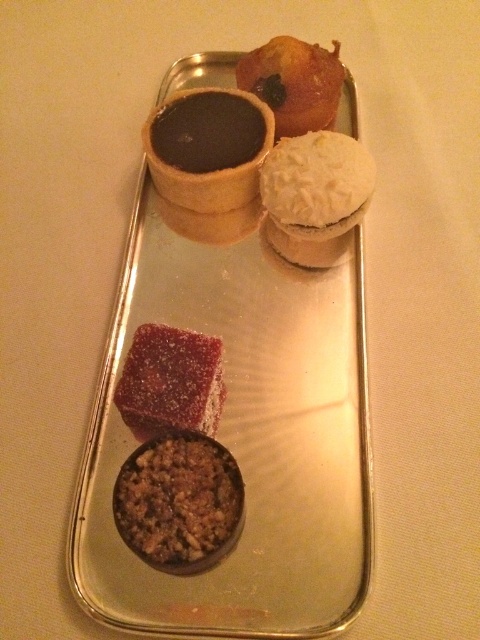
You are a guest at a tea party and want to grab the white coconut muffin at upper right. Which direction should you move your hand relative to the shiny silver tray at center to reach it?

The white coconut muffin at upper right is to the right of the shiny silver tray at center, so you should move your hand to the right of the shiny silver tray at center to reach it.

Looking at the desserts on the silver serving tray, which one has a smaller height between the brown crumbly at lower left and the white coconut muffin at upper right?

The brown crumbly at lower left has a lesser height compared to the white coconut muffin at upper right, so the brown crumbly at lower left is smaller in height.